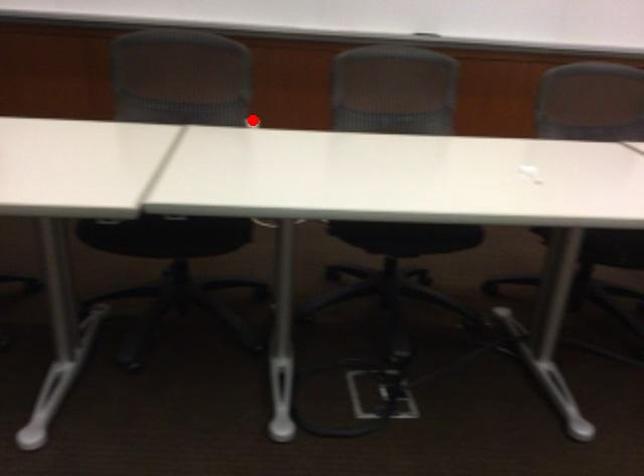
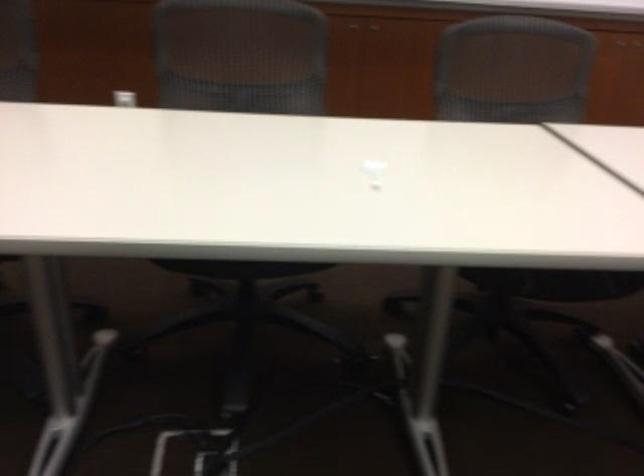
Question: I am providing you with two images of the same scene from different viewpoints. A red point is shown in image1. For the corresponding object point in image2, is it positioned nearer or farther from the camera?

Choices:
 (A) Nearer
 (B) Farther

Answer: (A)